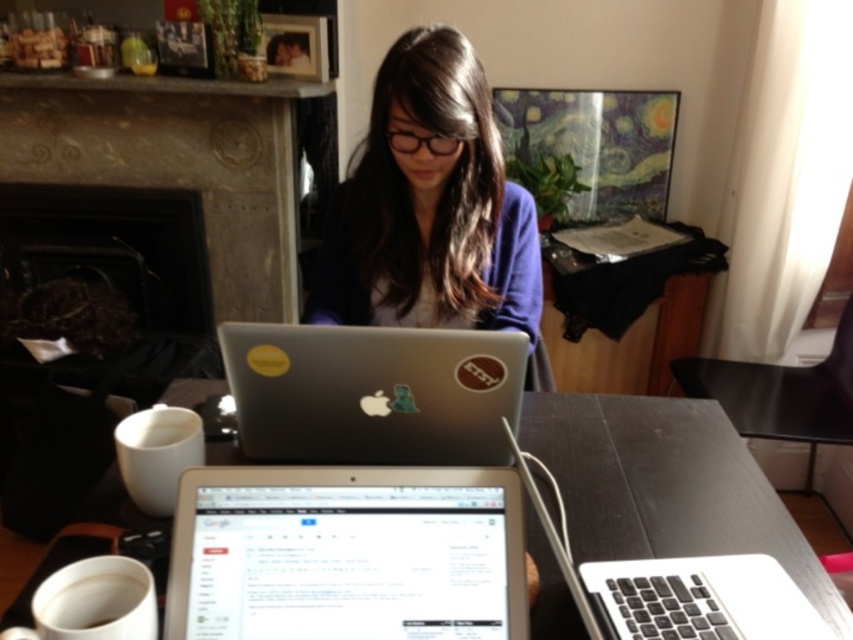
Question: Can you confirm if silver metallic tablet at center is wider than silver metallic laptop at center?

Choices:
 (A) yes
 (B) no

Answer: (B)

Question: Which is farther from the black matte table at center?

Choices:
 (A) matte purple sweater at center
 (B) white matte cup at lower left

Answer: (B)

Question: Which of the following is the farthest from the observer?

Choices:
 (A) pyautogui.click(x=317, y=493)
 (B) pyautogui.click(x=91, y=596)
 (C) pyautogui.click(x=352, y=369)

Answer: (C)

Question: Is silver metallic tablet at center positioned behind silver metallic laptop at center?

Choices:
 (A) yes
 (B) no

Answer: (B)

Question: Which object is the farthest from the white matte cup at lower left?

Choices:
 (A) silver metallic laptop at center
 (B) matte purple sweater at center
 (C) black matte table at center

Answer: (B)

Question: Does silver metallic tablet at center have a larger size compared to matte purple sweater at center?

Choices:
 (A) yes
 (B) no

Answer: (B)